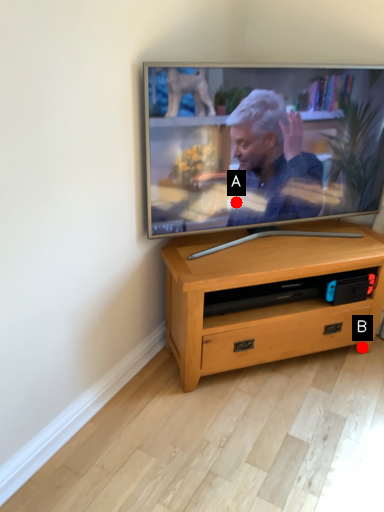
Question: Two points are circled on the image, labeled by A and B beside each circle. Among these points, which one is farthest from the camera?

Choices:
 (A) A is further
 (B) B is further

Answer: (B)